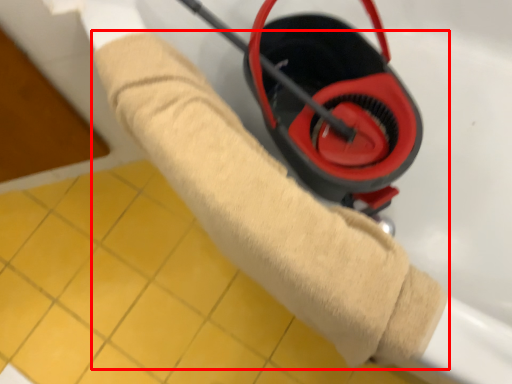
Question: From the image's perspective, what is the correct spatial relationship of towel (annotated by the red box) in relation to tile?

Choices:
 (A) below
 (B) above

Answer: (B)